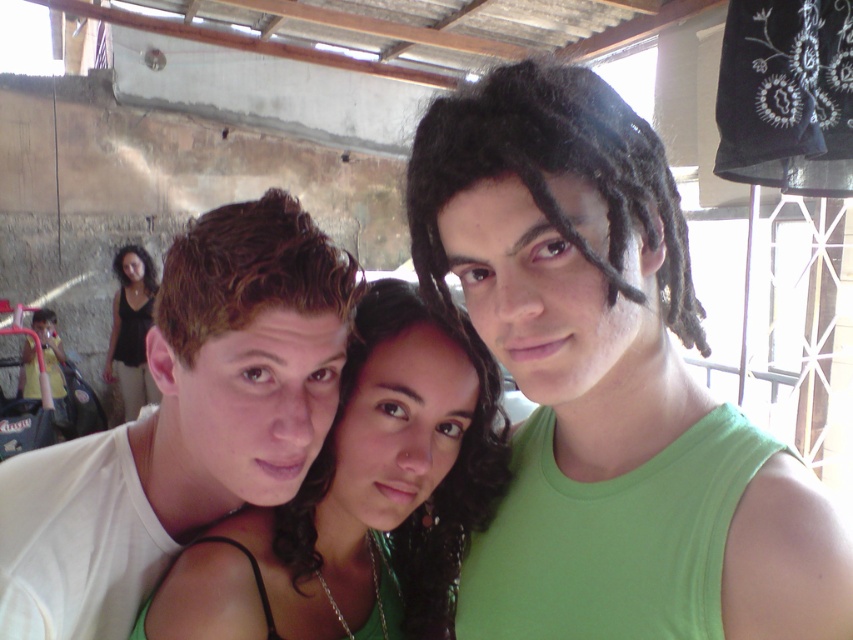
You are a photographer adjusting the lighting in the room. You notice the green matte tank top at center and the black fabric at left. Which of these two items is shorter in height?

The green matte tank top at center is not as tall as the black fabric at left, so the green matte tank top at center is shorter in height.

You are a photographer trying to adjust the lighting for a photo shoot. You notice two green items in the scene, the green matte tank top at center and the shiny green dress at center. Which of these items appears narrower?

The green matte tank top at center has a lesser width compared to the shiny green dress at center, so the green matte tank top at center appears narrower.

You are standing at the point marked as point (x=509, y=282) in the image. You want to take a photo of the three people in the scene. Since you are holding a camera with a 24mm lens, which has a field of view of 74 degrees, can you fit all three people into your shot without moving? Explain your reasoning.

The three people are 22.08 inches apart. With a 24mm lens providing a 74 degree field of view, the camera can capture a wide enough angle to include all three individuals standing closely together in the scene. Therefore, you can fit all three people into the shot without moving.